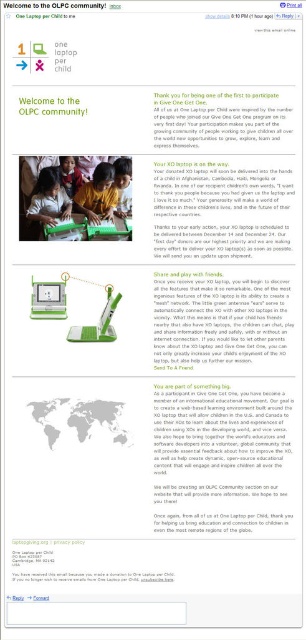
You are a volunteer organizing laptops for distribution. You have two laptops in front of you, the green matte laptop at center and the matte black laptop at center. Which one is closer to you?

The green matte laptop at center is closer to you because it is in front of the matte black laptop at center.